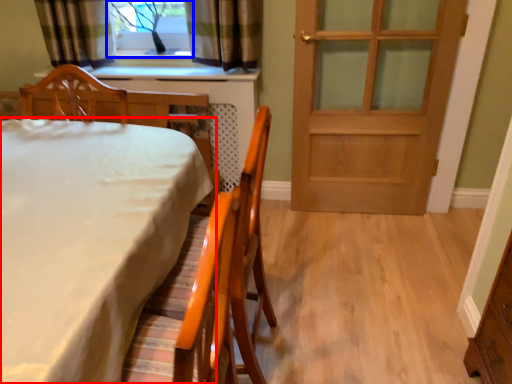
Question: Which object appears closest to the camera in this image, table (highlighted by a red box) or window (highlighted by a blue box)?

Choices:
 (A) table
 (B) window

Answer: (A)